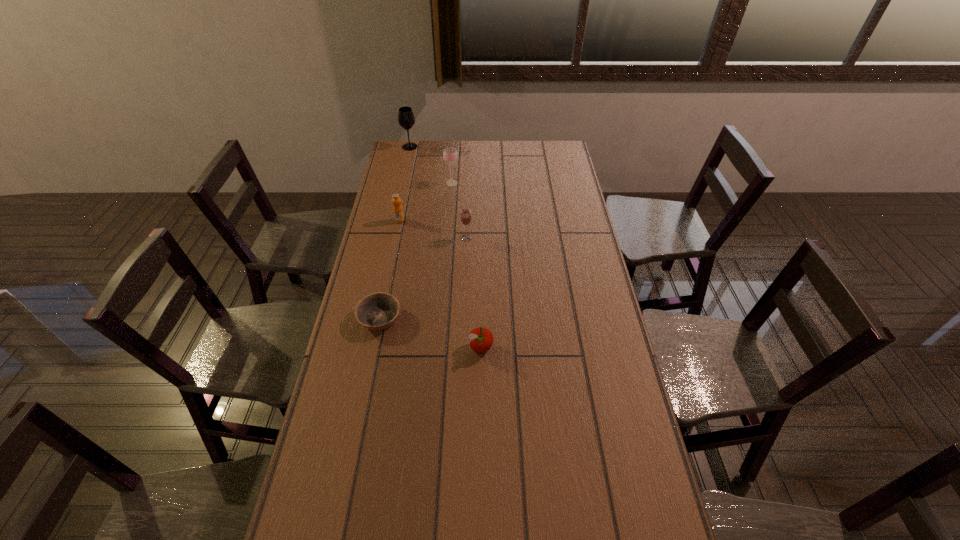
At what (x,y) coordinates should I click in order to perform the action: click on the shortest object. Please return your answer as a coordinate pair (x, y). Looking at the image, I should click on (378, 311).

Locate an element on the screen. The height and width of the screenshot is (540, 960). vacant position located on the right of the farthest object is located at coordinates (436, 147).

The image size is (960, 540). I want to click on free region located on the back of the fifth nearest object, so click(453, 164).

I want to click on vacant space positioned 0.180m on the back of the shortest wineglass, so click(468, 207).

Where is `free space located 0.210m on the front label of the fourth nearest object`? free space located 0.210m on the front label of the fourth nearest object is located at coordinates tap(392, 259).

Where is `vacant space located 0.240m on the front of the apple`? This screenshot has width=960, height=540. vacant space located 0.240m on the front of the apple is located at coordinates (481, 434).

This screenshot has height=540, width=960. I want to click on vacant area situated on the back of the bowl, so click(x=392, y=260).

Where is `object located at the far edge`? object located at the far edge is located at coordinates (406, 119).

The image size is (960, 540). Find the location of `wineglass present at the left edge`. wineglass present at the left edge is located at coordinates (406, 119).

At what (x,y) coordinates should I click in order to perform the action: click on orange juice that is at the left edge. Please return your answer as a coordinate pair (x, y). Looking at the image, I should click on (398, 213).